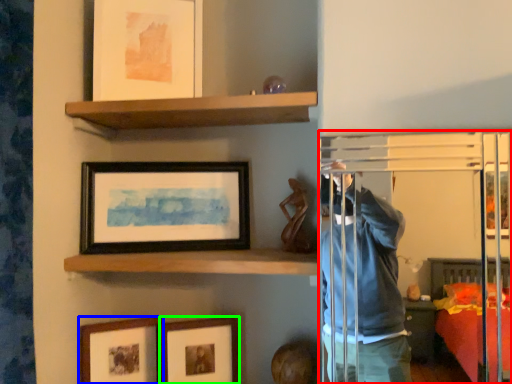
Question: Which object is positioned farthest from glass door (highlighted by a red box)? Select from picture frame (highlighted by a blue box) and picture frame (highlighted by a green box).

Choices:
 (A) picture frame
 (B) picture frame

Answer: (A)